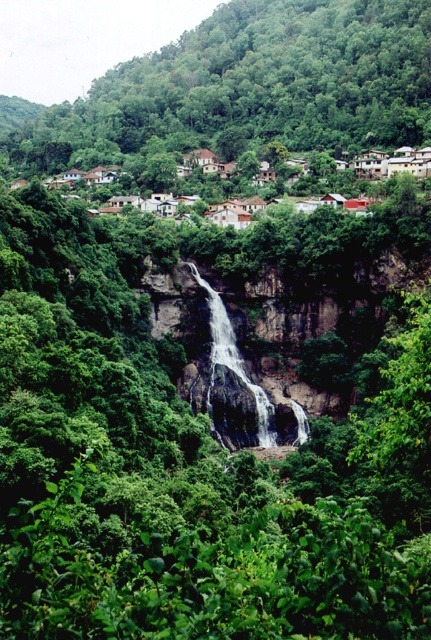
You are a hiker who wants to take a photo of the white smooth waterfall at center without the brown wooden houses at upper center blocking the view. What should you do?

The white smooth waterfall at center is behind the brown wooden houses at upper center, so you should move to a position where the brown wooden houses at upper center are no longer between you and the waterfall.

You are standing at the base of the waterfall and want to locate the green leafy tree at upper center. According to the coordinates provided, in which direction should you look to see it?

→ The green leafy tree at upper center is located at coordinates point (252, 86), which is above and to the left of the waterfall. You should look upward and to your left to see it.